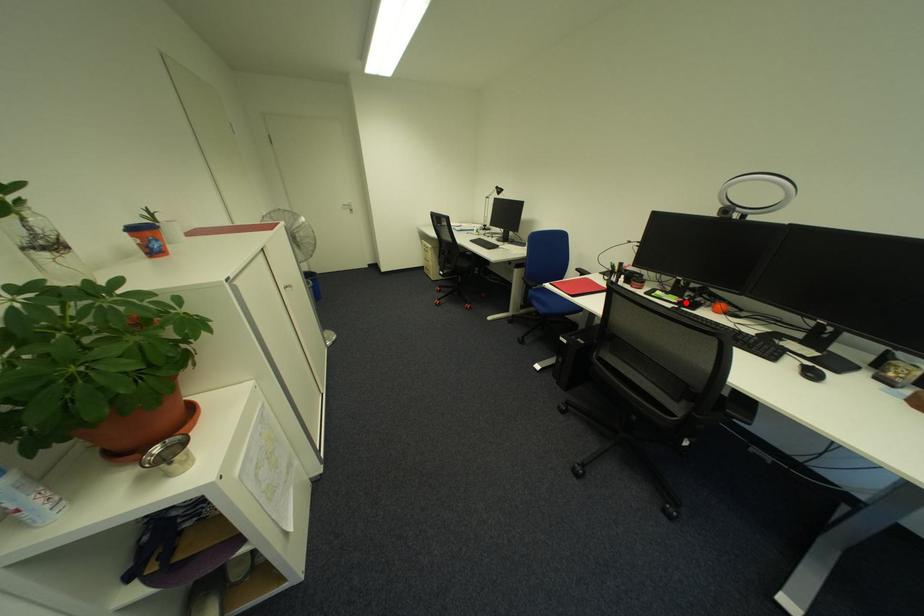
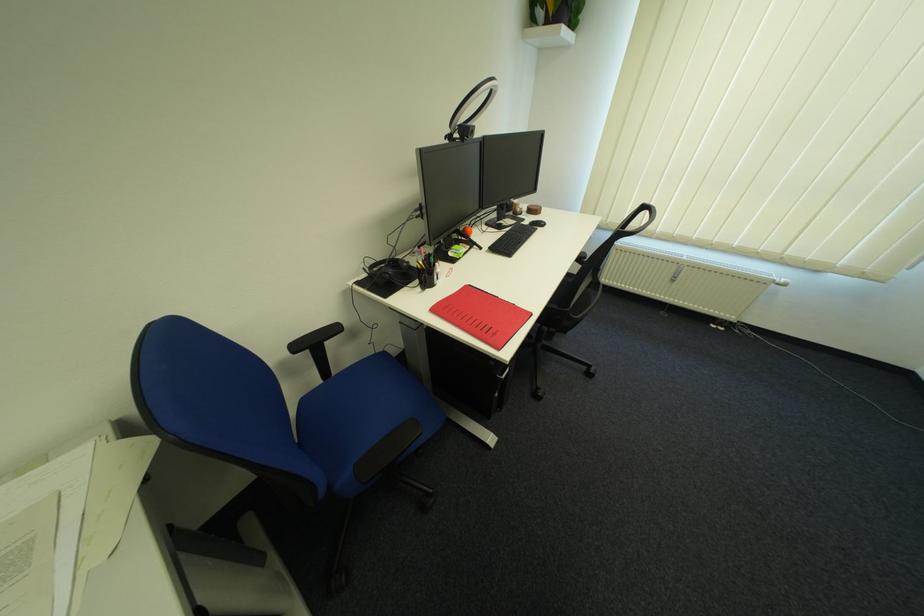
Question: I am providing you with two images of the same scene from different viewpoints. Image1 has a red point marked. In image2, the corresponding 3D location appears at what relative position? Reply with the corresponding letter.

Choices:
 (A) Closer
 (B) Farther

Answer: (A)